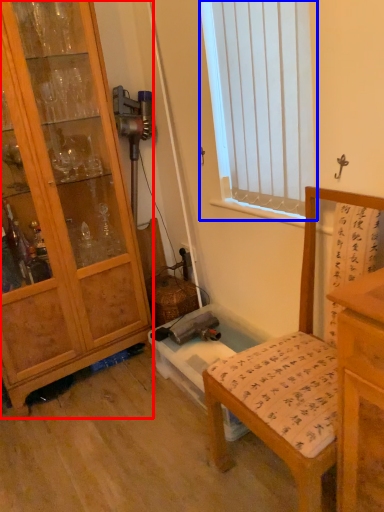
Question: Which of the following is the farthest to the observer, cabinetry (highlighted by a red box) or window (highlighted by a blue box)?

Choices:
 (A) cabinetry
 (B) window

Answer: (A)